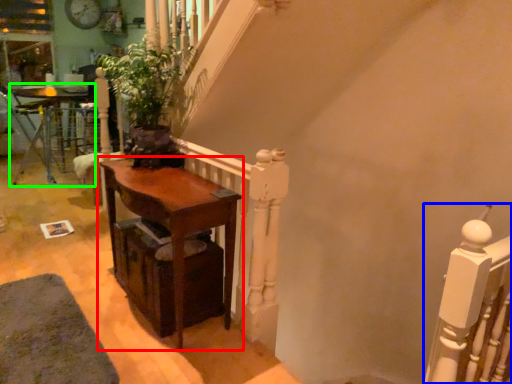
Question: Which object is the farthest from table (highlighted by a red box)? Choose among these: rail (highlighted by a blue box) or table (highlighted by a green box).

Choices:
 (A) rail
 (B) table

Answer: (B)